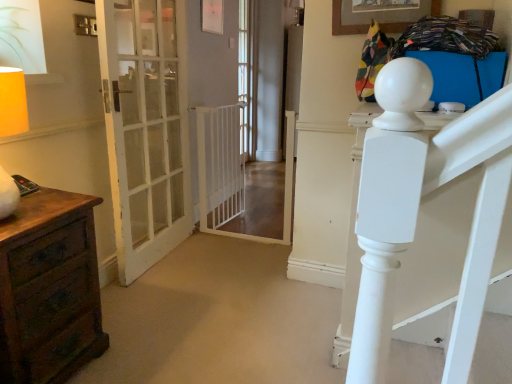
Question: Does clear glass door at center contain brown wood chest of drawers at left?

Choices:
 (A) yes
 (B) no

Answer: (B)

Question: Is the position of clear glass door at center more distant than that of brown wood chest of drawers at left?

Choices:
 (A) yes
 (B) no

Answer: (A)

Question: Is clear glass door at center outside of brown wood chest of drawers at left?

Choices:
 (A) no
 (B) yes

Answer: (B)

Question: From the image's perspective, is clear glass door at center located beneath brown wood chest of drawers at left?

Choices:
 (A) no
 (B) yes

Answer: (A)

Question: From the image's perspective, is clear glass door at center over brown wood chest of drawers at left?

Choices:
 (A) no
 (B) yes

Answer: (B)

Question: Does clear glass door at center have a lesser width compared to brown wood chest of drawers at left?

Choices:
 (A) no
 (B) yes

Answer: (B)

Question: Is white glass door at left positioned before brown wood chest of drawers at left?

Choices:
 (A) yes
 (B) no

Answer: (B)

Question: From the image's perspective, would you say white glass door at left is shown under brown wood chest of drawers at left?

Choices:
 (A) yes
 (B) no

Answer: (B)

Question: Considering the relative positions of white glass door at left and brown wood chest of drawers at left in the image provided, is white glass door at left behind brown wood chest of drawers at left?

Choices:
 (A) no
 (B) yes

Answer: (B)

Question: From a real-world perspective, is white glass door at left over brown wood chest of drawers at left?

Choices:
 (A) no
 (B) yes

Answer: (B)

Question: Can you confirm if white glass door at left is smaller than brown wood chest of drawers at left?

Choices:
 (A) yes
 (B) no

Answer: (B)

Question: Does white glass door at left appear on the right side of brown wood chest of drawers at left?

Choices:
 (A) no
 (B) yes

Answer: (B)

Question: Is white plastic gate at center at the left side of brown wood chest of drawers at left?

Choices:
 (A) no
 (B) yes

Answer: (A)